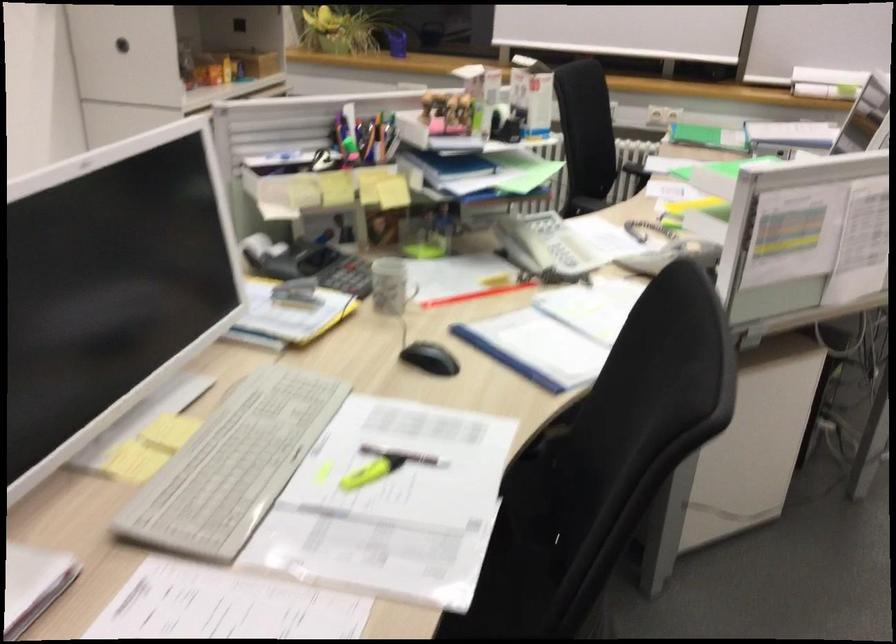
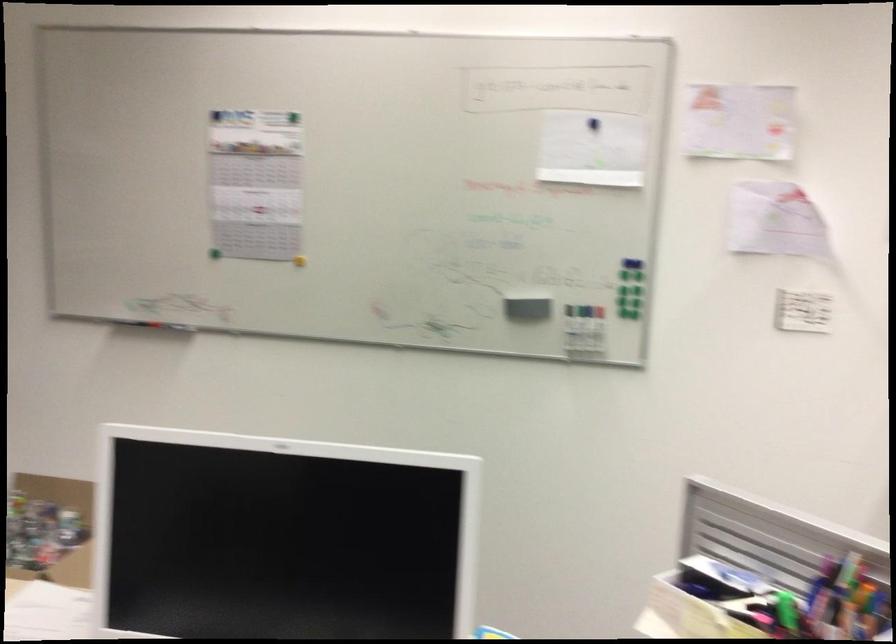
In the second image, find the point that corresponds to [334,143] in the first image.

(787, 610)